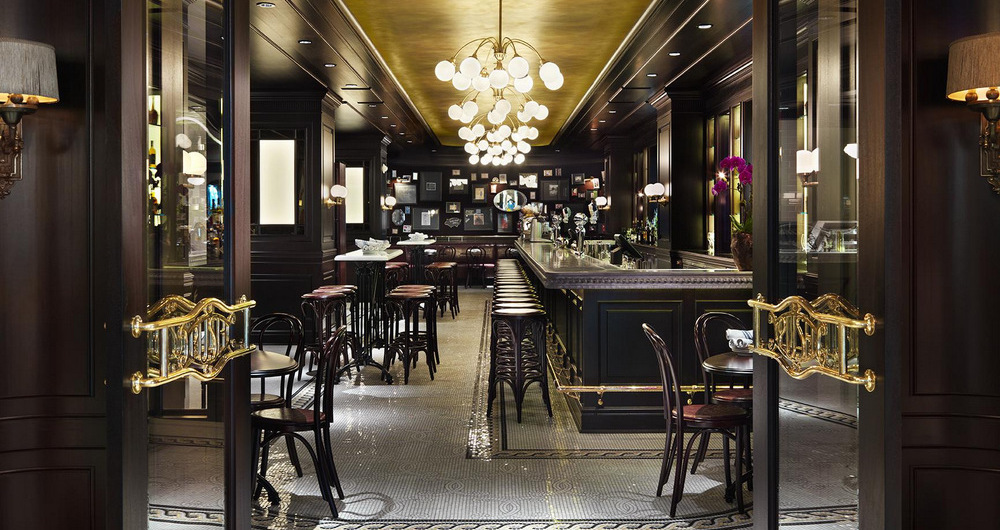
Where is `door handles`? door handles is located at coordinates (757, 326), (842, 349), (167, 344), (250, 322).